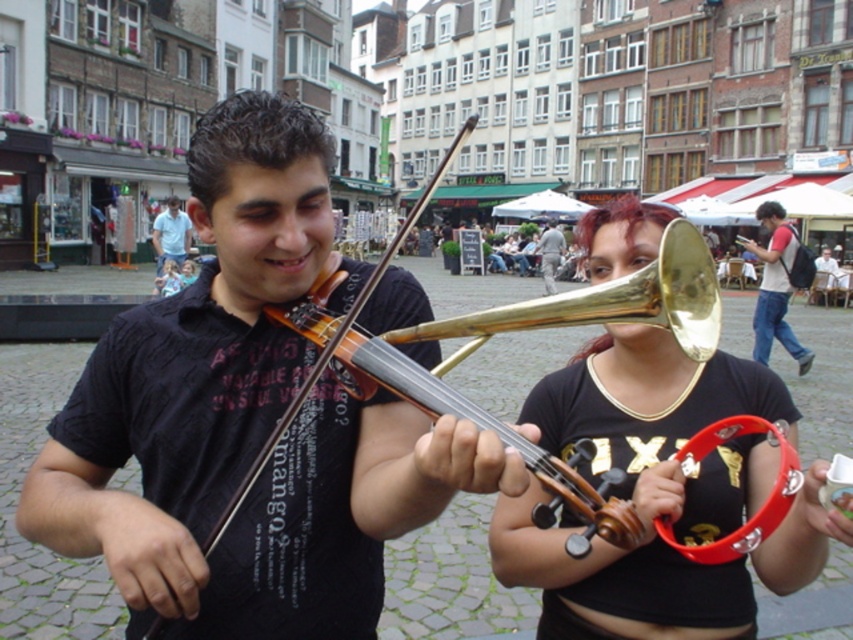
Question: Does gold brass trombone at center appear over light gray fabric jacket at center?

Choices:
 (A) yes
 (B) no

Answer: (B)

Question: Which object is positioned closest to the light gray fabric jacket at center?

Choices:
 (A) gold brass trombone at center
 (B) light blue shirt at center
 (C) white cotton t-shirt at upper right

Answer: (C)

Question: Estimate the real-world distances between objects in this image. Which object is closer to the white cotton t-shirt at upper right?

Choices:
 (A) gold brass trombone at center
 (B) white plastic cup at lower right
 (C) light blue shirt at center
 (D) light gray fabric jacket at center

Answer: (B)

Question: Which of the following is the farthest from the observer?

Choices:
 (A) white plastic cup at lower right
 (B) light gray fabric jacket at center

Answer: (B)

Question: Is gold brass trombone at center bigger than white cotton t-shirt at upper right?

Choices:
 (A) yes
 (B) no

Answer: (B)

Question: From the image, what is the correct spatial relationship of white cotton t-shirt at upper right in relation to white plastic cup at lower right?

Choices:
 (A) right
 (B) left

Answer: (B)